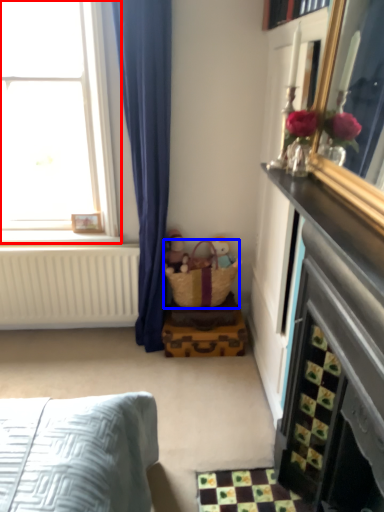
Question: Which object is closer to the camera taking this photo, window (highlighted by a red box) or basket (highlighted by a blue box)?

Choices:
 (A) window
 (B) basket

Answer: (A)